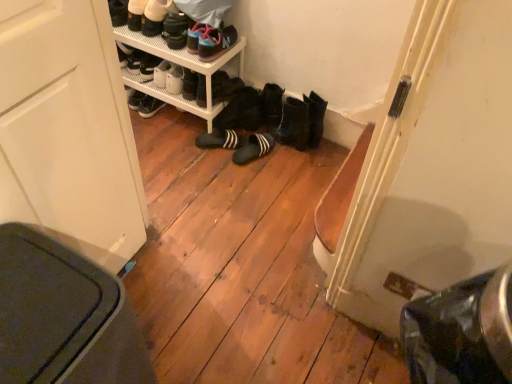
Image resolution: width=512 pixels, height=384 pixels. Identify the location of empty space that is in between black suede slippers at center, placed as the 1th footwear when sorted from bottom to top, and black suede slippers at center, marked as the 6th footwear in a top-to-bottom arrangement. (212, 148).